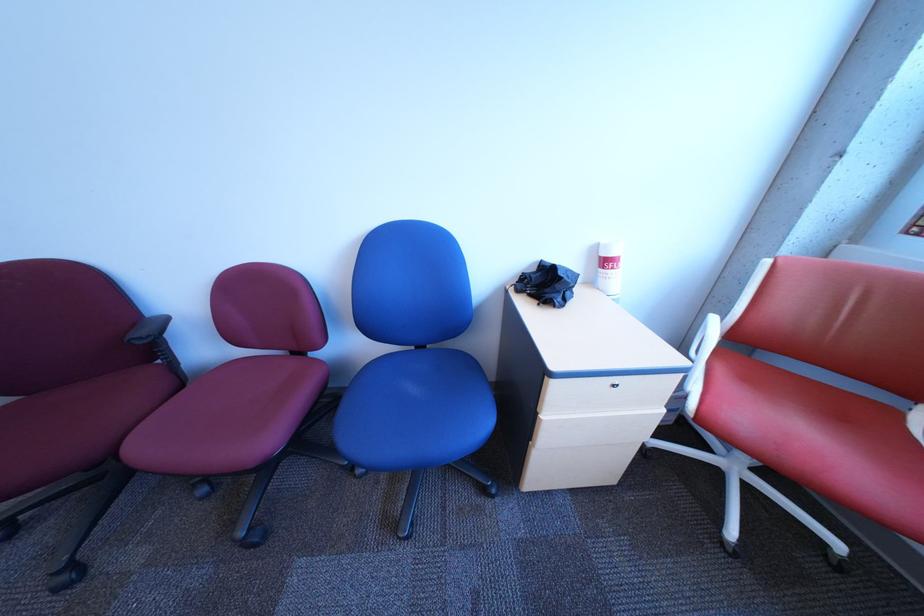
The width and height of the screenshot is (924, 616). What do you see at coordinates (417, 410) in the screenshot?
I see `a blue chair sitting surface` at bounding box center [417, 410].